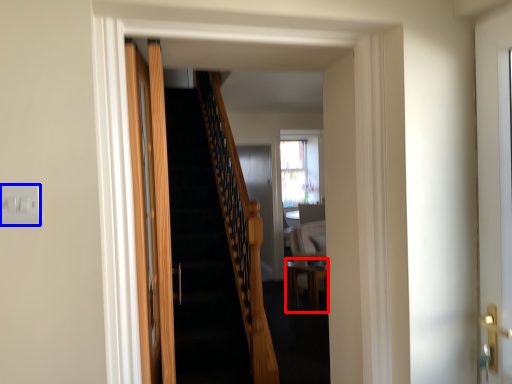
Question: Among these objects, which one is farthest to the camera, table (highlighted by a red box) or electric outlet (highlighted by a blue box)?

Choices:
 (A) table
 (B) electric outlet

Answer: (A)